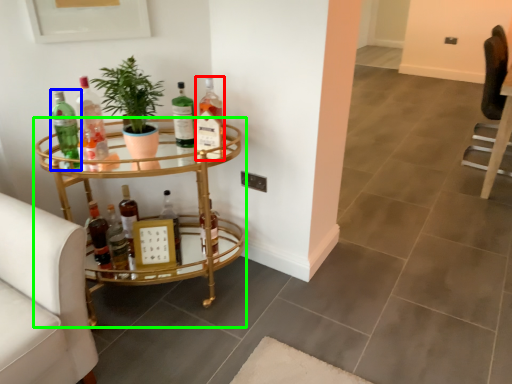
Question: Based on their relative distances, which object is farther from bottle (highlighted by a red box)? Choose from bottle (highlighted by a blue box) and table (highlighted by a green box).

Choices:
 (A) bottle
 (B) table

Answer: (A)